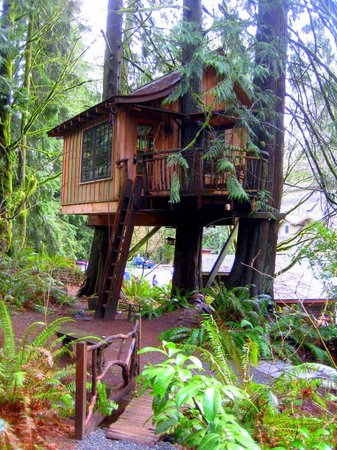
At what (x,y) coordinates should I click in order to perform the action: click on window in treehouse. Please return your answer as a coordinate pair (x, y). This screenshot has height=450, width=337. Looking at the image, I should click on (99, 146).